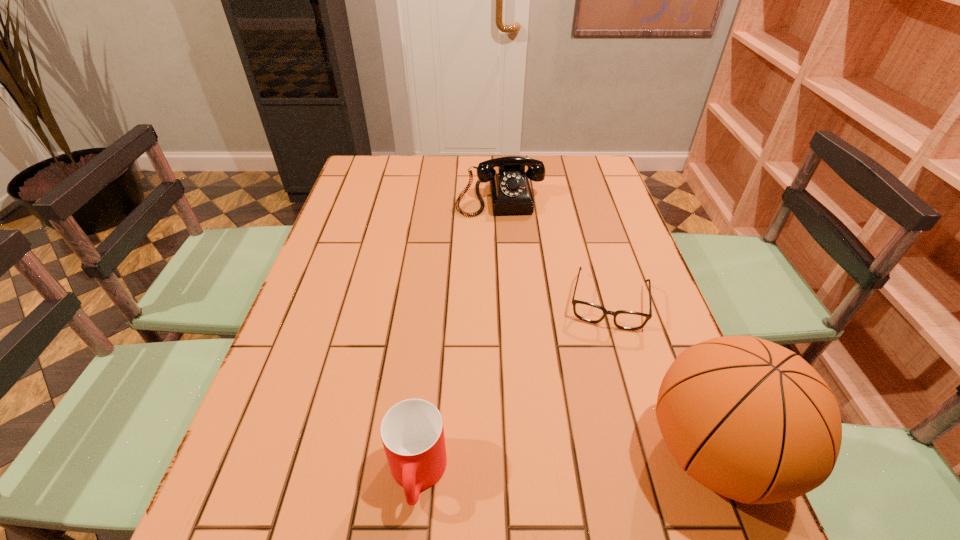
I want to click on vacant area situated 0.370m on the front-facing side of the spectacles, so click(588, 488).

You are a GUI agent. You are given a task and a screenshot of the screen. Output one action in this format:
    pyautogui.click(x=<x>, y=<y>)
    Task: Click on the free spot located 0.090m on the front-facing side of the spectacles
    The image size is (960, 540).
    Given the screenshot: What is the action you would take?
    pyautogui.click(x=601, y=361)

Find the location of a particular element. This screenshot has height=540, width=960. object located at the far edge is located at coordinates (510, 192).

Where is `cup at the near edge`? This screenshot has height=540, width=960. cup at the near edge is located at coordinates (412, 433).

Locate an element on the screen. The height and width of the screenshot is (540, 960). basketball situated at the near edge is located at coordinates click(747, 418).

Where is `basketball at the right edge`? Image resolution: width=960 pixels, height=540 pixels. basketball at the right edge is located at coordinates (747, 418).

You are a GUI agent. You are given a task and a screenshot of the screen. Output one action in this format:
    pyautogui.click(x=<x>, y=<y>)
    Task: Click on the spectacles positioned at the right edge
    
    Given the screenshot: What is the action you would take?
    pyautogui.click(x=627, y=320)

At what (x,y) coordinates should I click in order to perform the action: click on object that is at the near right corner. Please return your answer as a coordinate pair (x, y). The height and width of the screenshot is (540, 960). Looking at the image, I should click on (747, 418).

Identify the location of free region at the near edge of the desktop. (567, 440).

Where is `free space at the left edge of the desktop`? The width and height of the screenshot is (960, 540). free space at the left edge of the desktop is located at coordinates (310, 353).